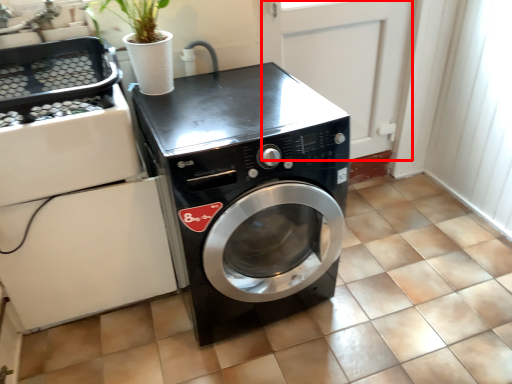
Question: Considering the relative positions of screen door (annotated by the red box) and washing machine in the image provided, where is screen door (annotated by the red box) located with respect to the staircase?

Choices:
 (A) right
 (B) left

Answer: (A)